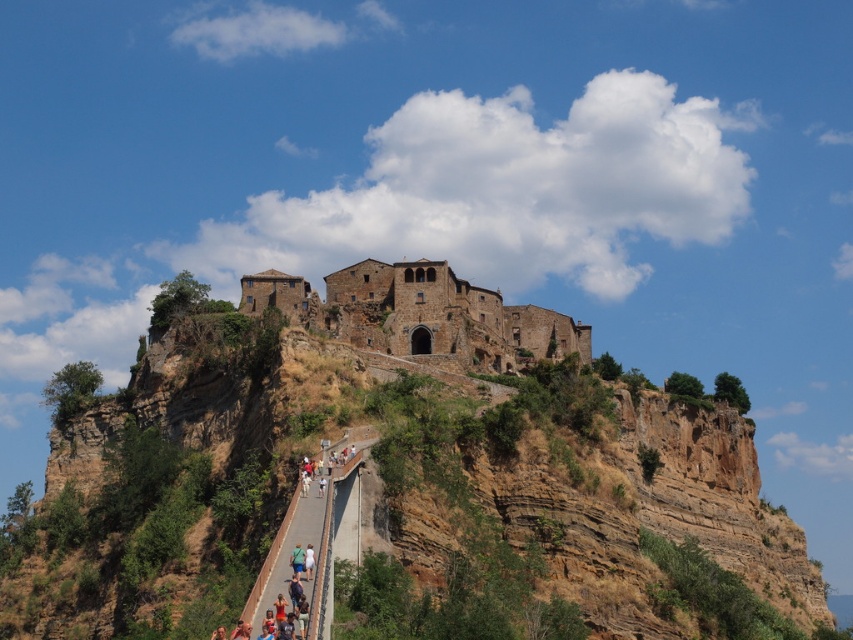
You are a photographer standing at the base of the cliff, looking up at the hilltop village. You see a light blue denim shorts at lower center and a green fabric person at lower center in your viewfinder. If you want to capture both subjects in a single frame without moving the camera, will they both fit in the shot considering their distance apart?

The light blue denim shorts at lower center is 38.86 centimeters from the green fabric person at lower center. Since the distance between them is relatively small, it is likely they can both fit in the photographer frame without moving the camera.

You are a photographer standing at the base of the cliff, looking up at the hilltop village. You notice a light blue denim shorts at lower center and a green fabric person at lower center. Which object is shorter in height?

The light blue denim shorts at lower center is not as tall as the green fabric person at lower center, so the light blue denim shorts at lower center is shorter in height.

You are standing at the base of the cliff looking up at the village. There are two points marked on the path leading to the village. Which point is closer to you, point (457, 308) or point (300, 572)?

Point (457, 308) is closer to you because it is further to the viewer than point (300, 572).